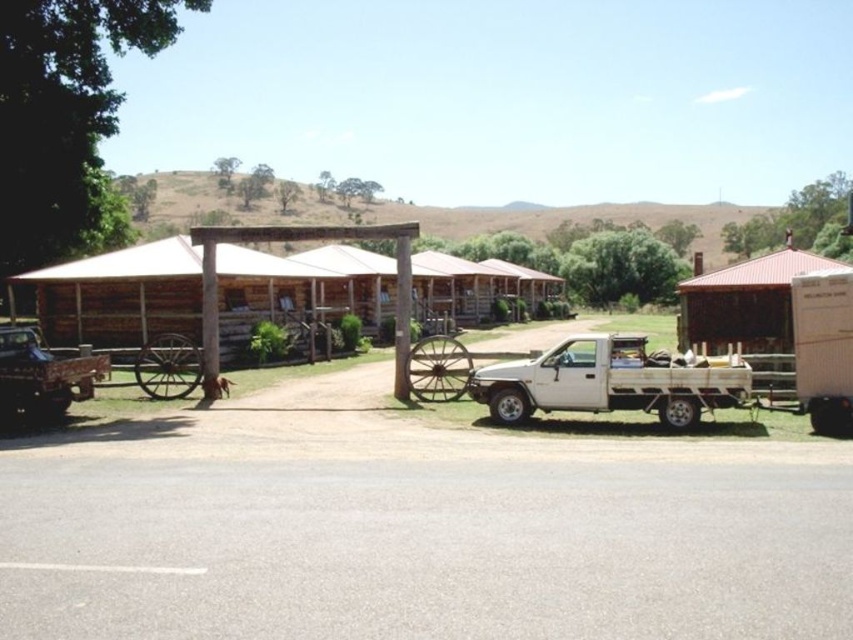
You are a delivery driver who needs to park your truck between the brown wooden hut at center and the rustic wooden hut at right. The truck is 20 feet long. Is there enough space between them to park your truck?

The distance between the brown wooden hut at center and the rustic wooden hut at right is 49.27 feet, which is more than enough to accommodate a 20 feet long truck. Yes, there is sufficient space to park the truck between them.

You are a delivery person trying to park your vehicle between the white matte truck at center and the brushed metal truck at left. Which side should you park on to ensure there is enough space for your vehicle?

The white matte truck at center might be wider than the brushed metal truck at left, so you should park on the side of the brushed metal truck at left to ensure there is enough space.

You are a delivery driver who needs to park your truck between the cabins and the wagon wheel. The white matte truck at center and the white matte truck at right are already parked there. Which truck takes up more space in the parking area?

The white matte truck at center takes up more space in the parking area because it is bigger than the white matte truck at right.